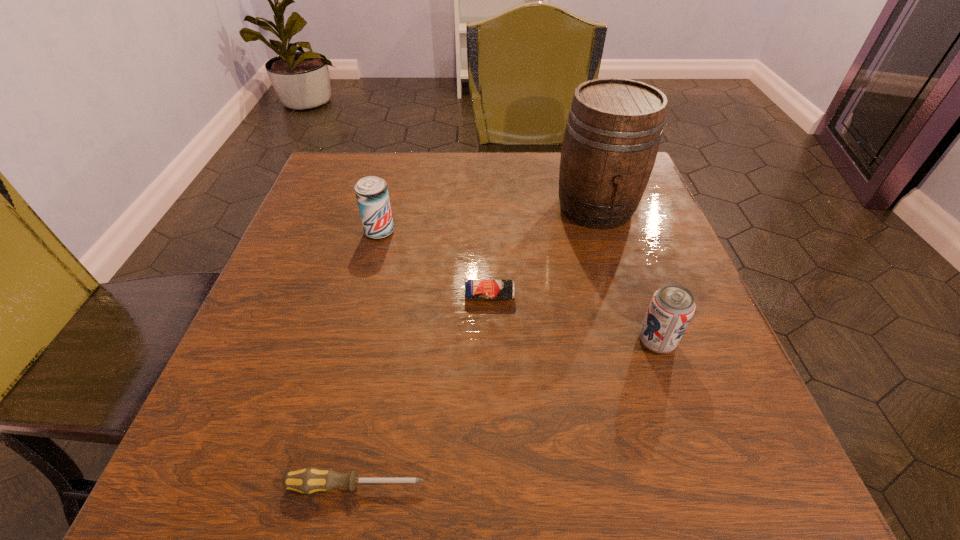
You are a GUI agent. You are given a task and a screenshot of the screen. Output one action in this format:
    pyautogui.click(x=<x>, y=<y>)
    Task: Click on the vacant space at the far edge
    
    Given the screenshot: What is the action you would take?
    pyautogui.click(x=392, y=177)

I want to click on vacant space at the near edge of the desktop, so click(x=489, y=444).

In the image, there is a desktop. Where is `vacant space at the left edge`? The image size is (960, 540). vacant space at the left edge is located at coordinates (323, 228).

Locate an element on the screen. free space at the right edge of the desktop is located at coordinates (638, 218).

Where is `vacant space at the far left corner of the desktop`? Image resolution: width=960 pixels, height=540 pixels. vacant space at the far left corner of the desktop is located at coordinates (337, 151).

Where is `vacant area at the near right corner of the desktop`? Image resolution: width=960 pixels, height=540 pixels. vacant area at the near right corner of the desktop is located at coordinates (756, 437).

Locate an element on the screen. unoccupied area between the tallest object and the nearest beer can is located at coordinates (626, 274).

Locate an element on the screen. The width and height of the screenshot is (960, 540). vacant space that's between the screwdriver and the leftmost beer can is located at coordinates (368, 359).

Where is `free space between the cider and the third object from right to left`? The height and width of the screenshot is (540, 960). free space between the cider and the third object from right to left is located at coordinates (542, 252).

Find the location of a particular element. This screenshot has height=540, width=960. free spot between the cider and the rightmost beer can is located at coordinates (626, 274).